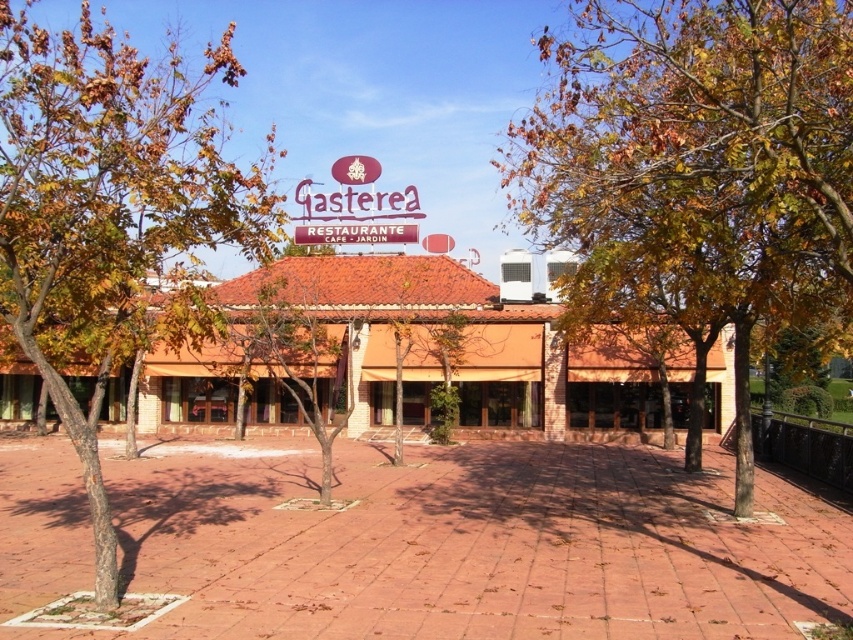
Question: Does yellow-green foliage at center have a smaller size compared to brown leafy tree at left?

Choices:
 (A) no
 (B) yes

Answer: (B)

Question: Can you confirm if yellow-green foliage at center is thinner than brown bark tree at center?

Choices:
 (A) no
 (B) yes

Answer: (B)

Question: Can you confirm if yellow-green foliage at center is positioned above brown bark tree at center?

Choices:
 (A) yes
 (B) no

Answer: (A)

Question: Which object is farther from the camera taking this photo?

Choices:
 (A) brown bark tree at center
 (B) yellow-green foliage at center

Answer: (A)

Question: Which point appears closest to the camera in this image?

Choices:
 (A) (260, 324)
 (B) (807, 124)

Answer: (B)

Question: Which object is the closest to the brown leafy tree at left?

Choices:
 (A) brown bark tree at center
 (B) yellow-green foliage at center

Answer: (A)